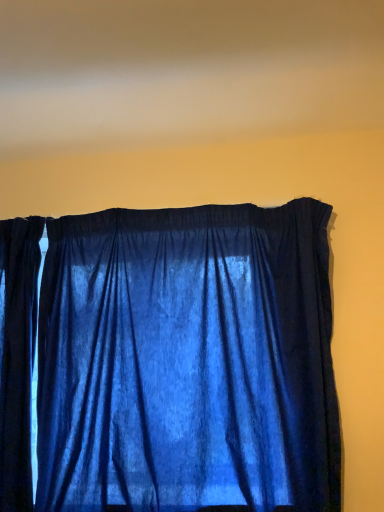
Question: Is blue velvet curtain at upper center in front of or behind velvet blue curtain at center in the image?

Choices:
 (A) front
 (B) behind

Answer: (A)

Question: Is blue velvet curtain at upper center to the left or to the right of velvet blue curtain at center in the image?

Choices:
 (A) right
 (B) left

Answer: (A)

Question: Is blue velvet curtain at upper center bigger or smaller than velvet blue curtain at center?

Choices:
 (A) big
 (B) small

Answer: (B)

Question: Considering the positions of point (13, 231) and point (271, 121), is point (13, 231) closer or farther from the camera than point (271, 121)?

Choices:
 (A) farther
 (B) closer

Answer: (B)

Question: From a real-world perspective, relative to blue velvet curtain at upper center, is velvet blue curtain at center vertically above or below?

Choices:
 (A) below
 (B) above

Answer: (A)

Question: Considering the positions of velvet blue curtain at center and blue velvet curtain at upper center in the image, is velvet blue curtain at center wider or thinner than blue velvet curtain at upper center?

Choices:
 (A) wide
 (B) thin

Answer: (B)

Question: Do you think velvet blue curtain at center is within blue velvet curtain at upper center, or outside of it?

Choices:
 (A) inside
 (B) outside

Answer: (B)